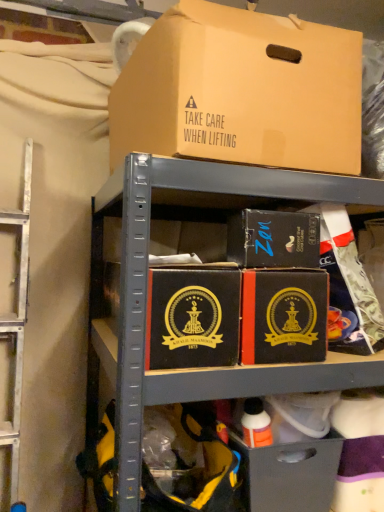
In order to click on brown cardboard box at upper center, placed as the 3th box when sorted from bottom to top in this screenshot , I will do `click(241, 91)`.

Image resolution: width=384 pixels, height=512 pixels. What do you see at coordinates (273, 239) in the screenshot?
I see `matte black box at center, placed as the 2th box when sorted from top to bottom` at bounding box center [273, 239].

What do you see at coordinates (289, 474) in the screenshot? The height and width of the screenshot is (512, 384). I see `matte black drawer at lower center` at bounding box center [289, 474].

Where is `black matte box at center, which is the 3th box in top-to-bottom order`? The height and width of the screenshot is (512, 384). black matte box at center, which is the 3th box in top-to-bottom order is located at coordinates (193, 317).

From a real-world perspective, is matte black drawer at lower center physically located above or below matte black box at center, placed as the 2th box when sorted from top to bottom?

From a real-world perspective, matte black drawer at lower center is physically below matte black box at center, placed as the 2th box when sorted from top to bottom.

Would you say matte black drawer at lower center is a long distance from matte black box at center, placed as the 2th box when sorted from top to bottom?

No.

Is matte black drawer at lower center thinner than matte black box at center, placed as the 2th box when sorted from top to bottom?

In fact, matte black drawer at lower center might be wider than matte black box at center, placed as the 2th box when sorted from top to bottom.

Find the location of `the 1st box in front of the matte black drawer at lower center`. the 1st box in front of the matte black drawer at lower center is located at coordinates (273, 239).

Is black matte box at center, which is the 3th box in top-to-bottom order, aimed at brown cardboard box at upper center, placed as the 3th box when sorted from bottom to top?

No, black matte box at center, which is the 3th box in top-to-bottom order, does not turn towards brown cardboard box at upper center, placed as the 3th box when sorted from bottom to top.

Do you think black matte box at center, the 1th box from the bottom, is within brown cardboard box at upper center, placed as the 3th box when sorted from bottom to top, or outside of it?

black matte box at center, the 1th box from the bottom, is located beyond the bounds of brown cardboard box at upper center, placed as the 3th box when sorted from bottom to top.

Looking at their sizes, would you say black matte box at center, which is the 3th box in top-to-bottom order, is wider or thinner than brown cardboard box at upper center, placed as the 3th box when sorted from bottom to top?

Considering their sizes, black matte box at center, which is the 3th box in top-to-bottom order, looks broader than brown cardboard box at upper center, placed as the 3th box when sorted from bottom to top.

Is black matte box at center, the 1th box from the bottom, directly adjacent to brown cardboard box at upper center, placed as the 3th box when sorted from bottom to top?

No, black matte box at center, the 1th box from the bottom, is not making contact with brown cardboard box at upper center, placed as the 3th box when sorted from bottom to top.

From the image's perspective, between black matte box at center, which is the 3th box in top-to-bottom order, and matte black box at center, which is the 2th box from bottom to top, who is located below?

black matte box at center, which is the 3th box in top-to-bottom order.

Based on the photo, who is smaller, black matte box at center, which is the 3th box in top-to-bottom order, or matte black box at center, placed as the 2th box when sorted from top to bottom?

matte black box at center, placed as the 2th box when sorted from top to bottom, is smaller.

Is point (189, 301) farther from camera compared to point (254, 252)?

No, it is in front of (254, 252).

From a real-world perspective, is black matte box at center, which is the 3th box in top-to-bottom order, physically located above or below matte black drawer at lower center?

From a real-world perspective, black matte box at center, which is the 3th box in top-to-bottom order, is physically above matte black drawer at lower center.

From the image's perspective, is black matte box at center, the 1th box from the bottom, located beneath matte black drawer at lower center?

Incorrect, from the image's perspective, black matte box at center, the 1th box from the bottom, is higher than matte black drawer at lower center.

Considering the relative positions of black matte box at center, the 1th box from the bottom, and matte black drawer at lower center in the image provided, is black matte box at center, the 1th box from the bottom, in front of matte black drawer at lower center?

Yes, it is.

Considering the sizes of black matte box at center, the 1th box from the bottom, and matte black drawer at lower center in the image, is black matte box at center, the 1th box from the bottom, wider or thinner than matte black drawer at lower center?

black matte box at center, the 1th box from the bottom, is wider than matte black drawer at lower center.

Considering the sizes of objects brown cardboard box at upper center, placed as the 3th box when sorted from bottom to top, and matte black box at center, placed as the 2th box when sorted from top to bottom, in the image provided, who is taller, brown cardboard box at upper center, placed as the 3th box when sorted from bottom to top, or matte black box at center, placed as the 2th box when sorted from top to bottom,?

brown cardboard box at upper center, placed as the 3th box when sorted from bottom to top, is taller.

Could you measure the distance between brown cardboard box at upper center, placed as the 3th box when sorted from bottom to top, and matte black box at center, placed as the 2th box when sorted from top to bottom?

brown cardboard box at upper center, placed as the 3th box when sorted from bottom to top, is 9.39 inches away from matte black box at center, placed as the 2th box when sorted from top to bottom.

From the image's perspective, which is below, brown cardboard box at upper center, placed as the 3th box when sorted from bottom to top, or matte black box at center, which is the 2th box from bottom to top?

From the image's view, matte black box at center, which is the 2th box from bottom to top, is below.

From a real-world perspective, which is physically below, brown cardboard box at upper center, placed as the 3th box when sorted from bottom to top, or matte black box at center, which is the 2th box from bottom to top?

matte black box at center, which is the 2th box from bottom to top, from a real-world perspective.

Is brown cardboard box at upper center, placed as the first box when sorted from top to bottom, at the right side of black matte box at center, the 1th box from the bottom?

Yes, brown cardboard box at upper center, placed as the first box when sorted from top to bottom, is to the right of black matte box at center, the 1th box from the bottom.

Is brown cardboard box at upper center, placed as the first box when sorted from top to bottom, facing towards black matte box at center, the 1th box from the bottom?

No, brown cardboard box at upper center, placed as the first box when sorted from top to bottom, is not aimed at black matte box at center, the 1th box from the bottom.

Is brown cardboard box at upper center, placed as the first box when sorted from top to bottom, far from black matte box at center, the 1th box from the bottom?

No, brown cardboard box at upper center, placed as the first box when sorted from top to bottom, is not far from black matte box at center, the 1th box from the bottom.

What's the angular difference between matte black drawer at lower center and brown cardboard box at upper center, placed as the first box when sorted from top to bottom,'s facing directions?

The facing directions of matte black drawer at lower center and brown cardboard box at upper center, placed as the first box when sorted from top to bottom, are 1.77 degrees apart.

From a real-world perspective, is matte black drawer at lower center physically below brown cardboard box at upper center, placed as the 3th box when sorted from bottom to top?

Yes, from a real-world perspective, matte black drawer at lower center is below brown cardboard box at upper center, placed as the 3th box when sorted from bottom to top.

Is matte black drawer at lower center positioned beyond the bounds of brown cardboard box at upper center, placed as the 3th box when sorted from bottom to top?

matte black drawer at lower center lies outside brown cardboard box at upper center, placed as the 3th box when sorted from bottom to top,'s area.

Identify the location of drawer on the right side of matte black box at center, which is the 2th box from bottom to top. The width and height of the screenshot is (384, 512). 289,474.

You are a GUI agent. You are given a task and a screenshot of the screen. Output one action in this format:
    pyautogui.click(x=<x>, y=<y>)
    Task: Click on the box that is the 2nd object located above the black matte box at center, which is the 3th box in top-to-bottom order (from the image's perspective)
    
    Given the screenshot: What is the action you would take?
    pyautogui.click(x=241, y=91)

Considering their positions, is matte black drawer at lower center positioned closer to black matte box at center, the 1th box from the bottom, than brown cardboard box at upper center, placed as the first box when sorted from top to bottom?

Based on the image, brown cardboard box at upper center, placed as the first box when sorted from top to bottom, appears to be nearer to black matte box at center, the 1th box from the bottom.

In the scene shown: Looking at the image, which one is located closer to black matte box at center, the 1th box from the bottom, matte black box at center, which is the 2th box from bottom to top, or matte black drawer at lower center?

Among the two, matte black box at center, which is the 2th box from bottom to top, is located nearer to black matte box at center, the 1th box from the bottom.

When comparing their distances from black matte box at center, which is the 3th box in top-to-bottom order, does brown cardboard box at upper center, placed as the 3th box when sorted from bottom to top, or matte black drawer at lower center seem further?

matte black drawer at lower center is positioned further to the anchor black matte box at center, which is the 3th box in top-to-bottom order.

From the image, which object appears to be farther from matte black drawer at lower center, brown cardboard box at upper center, placed as the 3th box when sorted from bottom to top, or matte black box at center, which is the 2th box from bottom to top?

Based on the image, brown cardboard box at upper center, placed as the 3th box when sorted from bottom to top, appears to be further to matte black drawer at lower center.

From the image, which object appears to be nearer to matte black box at center, which is the 2th box from bottom to top, black matte box at center, the 1th box from the bottom, or brown cardboard box at upper center, placed as the first box when sorted from top to bottom?

black matte box at center, the 1th box from the bottom, is positioned closer to the anchor matte black box at center, which is the 2th box from bottom to top.

When comparing their distances from matte black drawer at lower center, does brown cardboard box at upper center, placed as the first box when sorted from top to bottom, or black matte box at center, which is the 3th box in top-to-bottom order, seem closer?

black matte box at center, which is the 3th box in top-to-bottom order.

From the image, which object appears to be farther from matte black box at center, placed as the 2th box when sorted from top to bottom, brown cardboard box at upper center, placed as the 3th box when sorted from bottom to top, or black matte box at center, the 1th box from the bottom?

Based on the image, brown cardboard box at upper center, placed as the 3th box when sorted from bottom to top, appears to be further to matte black box at center, placed as the 2th box when sorted from top to bottom.

Based on their spatial positions, is matte black box at center, which is the 2th box from bottom to top, or brown cardboard box at upper center, placed as the 3th box when sorted from bottom to top, closer to black matte box at center, which is the 3th box in top-to-bottom order?

matte black box at center, which is the 2th box from bottom to top, lies closer to black matte box at center, which is the 3th box in top-to-bottom order, than the other object.

Identify the location of box between matte black box at center, placed as the 2th box when sorted from top to bottom, and matte black drawer at lower center vertically. (193, 317).

Identify the location of box between brown cardboard box at upper center, placed as the 3th box when sorted from bottom to top, and black matte box at center, the 1th box from the bottom, in the up-down direction. (273, 239).